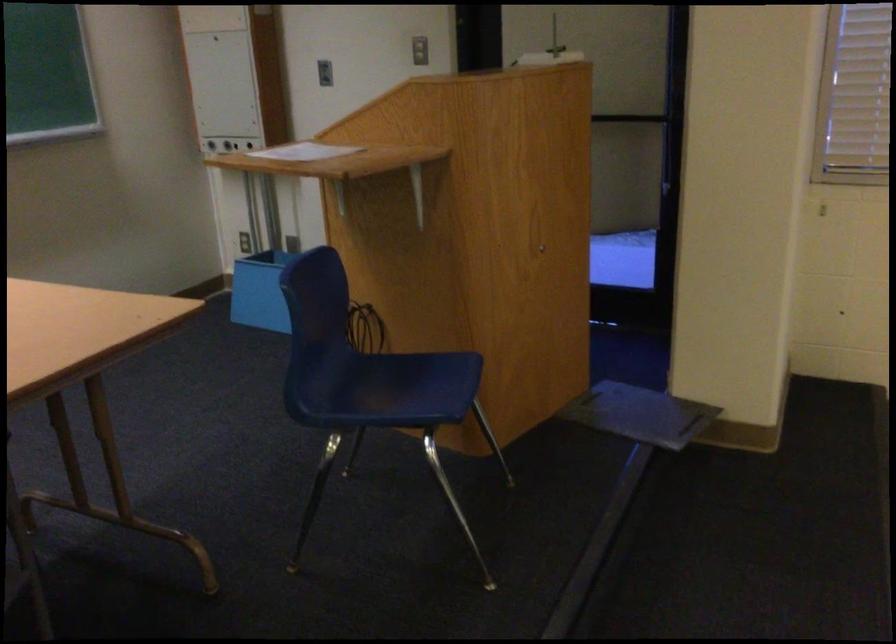
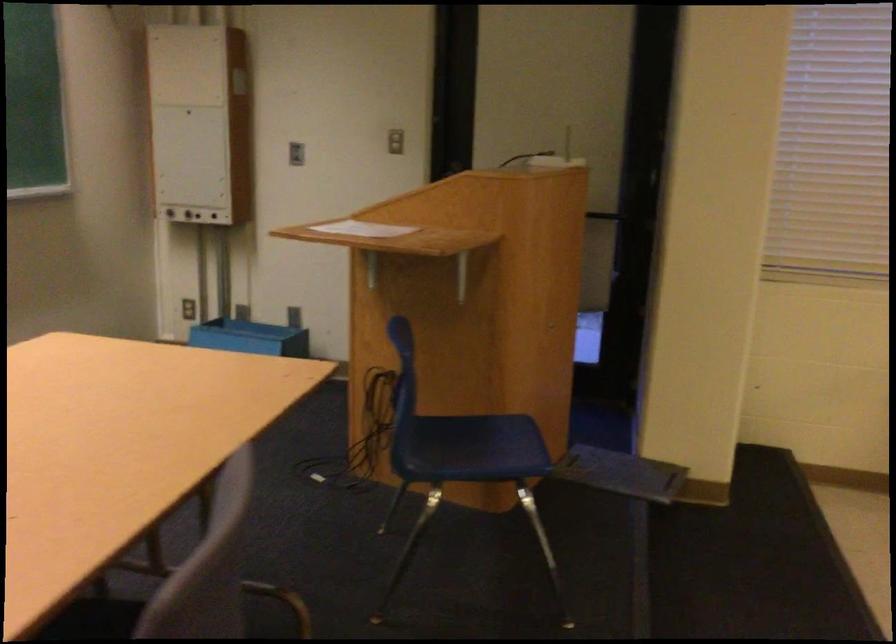
The point at (319,153) is marked in the first image. Where is the corresponding point in the second image?

(362, 229)